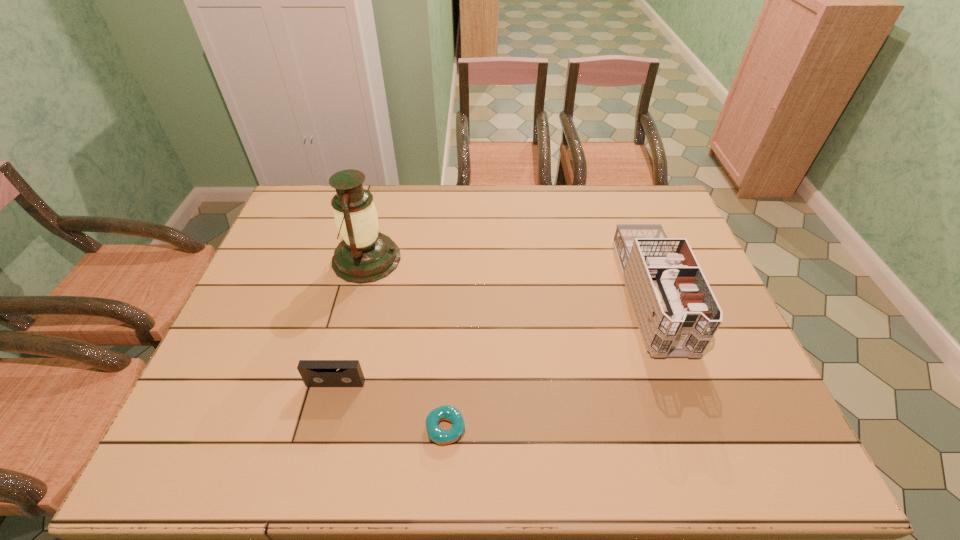
I want to click on lantern, so click(x=365, y=255).

You are a GUI agent. You are given a task and a screenshot of the screen. Output one action in this format:
    pyautogui.click(x=<x>, y=<y>)
    Task: Click on the rightmost object
    The height and width of the screenshot is (540, 960).
    Given the screenshot: What is the action you would take?
    pyautogui.click(x=677, y=314)

Locate an element on the screen. the third shortest object is located at coordinates (677, 314).

Where is `videotape`? Image resolution: width=960 pixels, height=540 pixels. videotape is located at coordinates (x=315, y=373).

Where is `the second shortest object`? The width and height of the screenshot is (960, 540). the second shortest object is located at coordinates (315, 373).

Where is `doughnut`? doughnut is located at coordinates (449, 413).

Locate an element on the screen. the third object from left to right is located at coordinates (449, 413).

Where is `vacant point located 0.050m with the light compartment facing forward on the tallest object`? The image size is (960, 540). vacant point located 0.050m with the light compartment facing forward on the tallest object is located at coordinates [417, 259].

Locate an element on the screen. This screenshot has height=540, width=960. vacant space located at the entrance of the rightmost object is located at coordinates (689, 400).

Locate an element on the screen. free space located 0.060m on the front-facing side of the third farthest object is located at coordinates (329, 410).